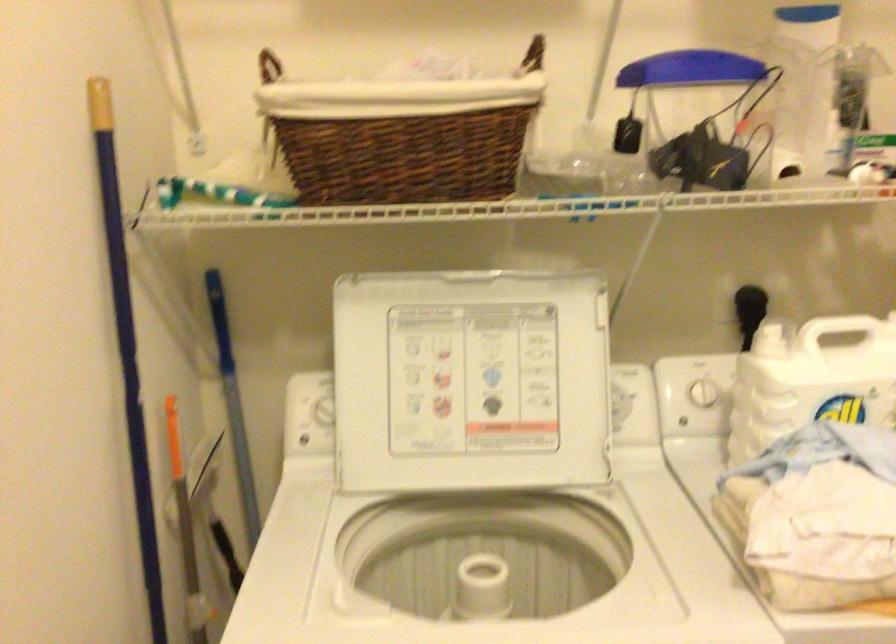
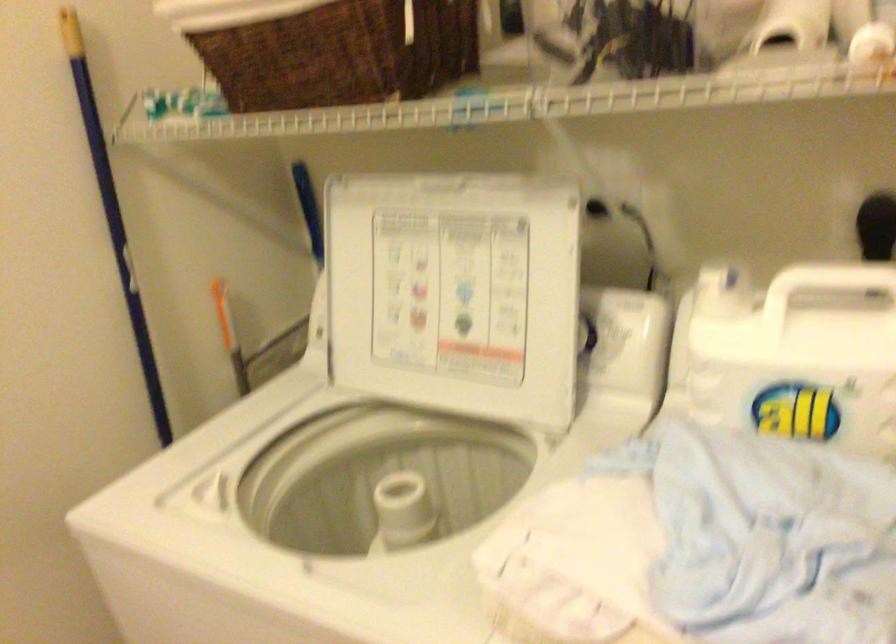
In the second image, find the point that corresponds to (698,359) in the first image.

(804, 288)